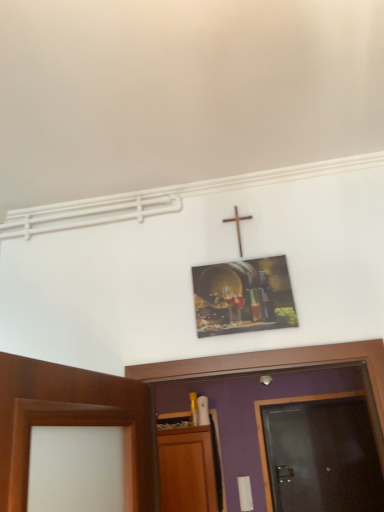
Question: Does metallic wine barrel at upper center appear on the right side of dark wood door at right?

Choices:
 (A) no
 (B) yes

Answer: (A)

Question: Considering the relative sizes of metallic wine barrel at upper center and dark wood door at right in the image provided, is metallic wine barrel at upper center thinner than dark wood door at right?

Choices:
 (A) yes
 (B) no

Answer: (A)

Question: Is metallic wine barrel at upper center located outside dark wood door at right?

Choices:
 (A) no
 (B) yes

Answer: (B)

Question: Is metallic wine barrel at upper center with dark wood door at right?

Choices:
 (A) no
 (B) yes

Answer: (A)

Question: From the image's perspective, would you say metallic wine barrel at upper center is shown under dark wood door at right?

Choices:
 (A) yes
 (B) no

Answer: (B)

Question: From the image's perspective, does metallic wine barrel at upper center appear higher than dark wood door at right?

Choices:
 (A) yes
 (B) no

Answer: (A)

Question: Could you tell me if metallic wine barrel at upper center is facing wooden cross at upper center?

Choices:
 (A) yes
 (B) no

Answer: (B)

Question: Is metallic wine barrel at upper center oriented away from wooden cross at upper center?

Choices:
 (A) no
 (B) yes

Answer: (A)

Question: Is metallic wine barrel at upper center thinner than wooden cross at upper center?

Choices:
 (A) no
 (B) yes

Answer: (A)

Question: Is metallic wine barrel at upper center completely or partially outside of wooden cross at upper center?

Choices:
 (A) yes
 (B) no

Answer: (A)

Question: Is the depth of metallic wine barrel at upper center greater than that of wooden cross at upper center?

Choices:
 (A) yes
 (B) no

Answer: (B)

Question: Is metallic wine barrel at upper center positioned before wooden cross at upper center?

Choices:
 (A) yes
 (B) no

Answer: (A)

Question: Is the depth of dark wood door at right greater than that of wooden cross at upper center?

Choices:
 (A) yes
 (B) no

Answer: (A)